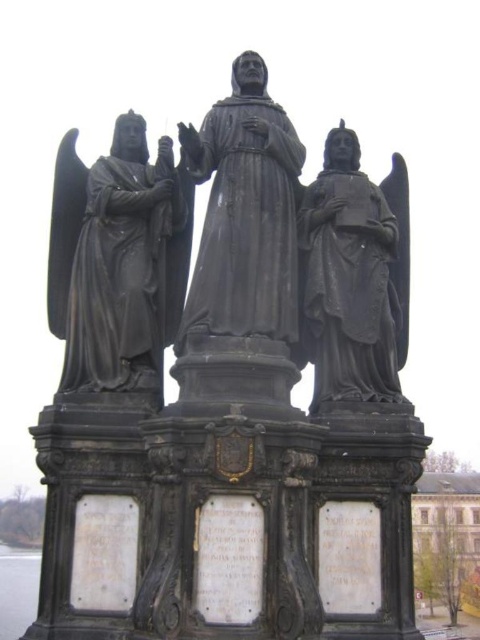
You are an art conservator assessing the statue group. You need to determine the spatial relationship between the black stone statue at center and the matte black statue at right. Which statue is higher in elevation?

The black stone statue at center is positioned over the matte black statue at right, meaning it is higher in elevation.

You are an art conservator assessing the statue group. You need to determine if the black polished statue at left can be moved to the position of the matte black statue at right without any adjustments. What should you consider regarding their widths?

The black polished statue at left might be wider than the matte black statue at right, so moving it without adjustments could be problematic due to the potential width difference.